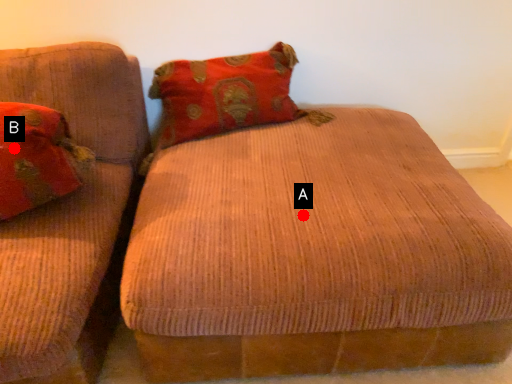
Question: Two points are circled on the image, labeled by A and B beside each circle. Which point is farther from the camera taking this photo?

Choices:
 (A) A is further
 (B) B is further

Answer: (A)